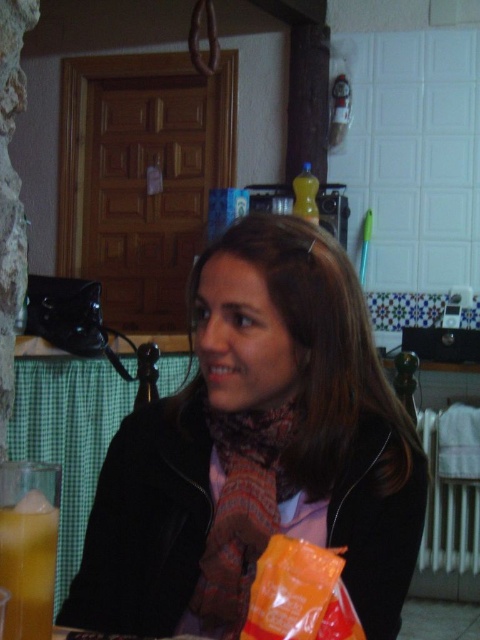
Based on the photo, can you confirm if matte black jacket at center is positioned to the right of translucent glass juice at lower left?

Yes, matte black jacket at center is to the right of translucent glass juice at lower left.

Between matte black jacket at center and translucent glass juice at lower left, which one has more height?

With more height is matte black jacket at center.

Does point (379, 584) come behind point (7, 579)?

That is True.

Locate an element on the screen. matte black jacket at center is located at coordinates tap(257, 451).

Does matte black jacket at center have a greater width compared to multicolored woven scarf at center?

Yes.

Is matte black jacket at center thinner than multicolored woven scarf at center?

No.

Who is more distant from viewer, (x=285, y=259) or (x=251, y=476)?

The point (x=251, y=476) is more distant.

Identify the location of matte black jacket at center. The image size is (480, 640). (257, 451).

Which is above, multicolored woven scarf at center or translucent glass juice at lower left?

multicolored woven scarf at center

Does multicolored woven scarf at center come in front of translucent glass juice at lower left?

No.

Find the location of a particular element. multicolored woven scarf at center is located at coordinates (240, 513).